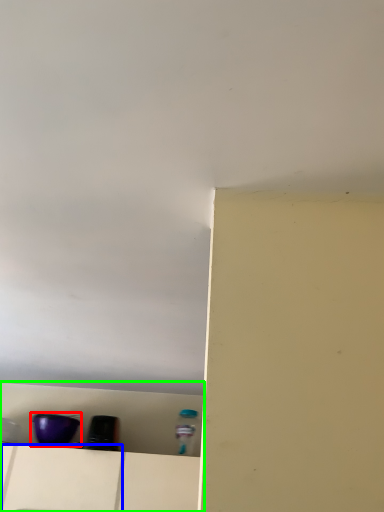
Question: Considering the real-world distances, which object is closest to appliance (highlighted by a red box)? drawer (highlighted by a blue box) or shelf (highlighted by a green box).

Choices:
 (A) drawer
 (B) shelf

Answer: (A)